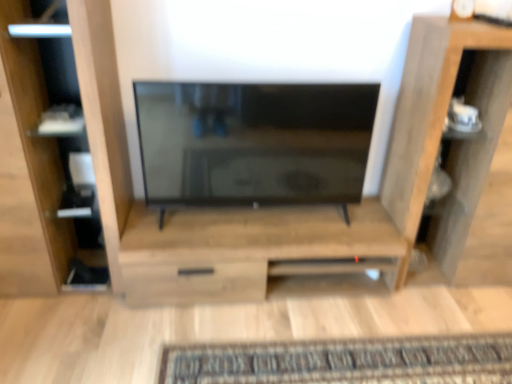
Question: From the image's perspective, is matte black tv at center located beneath wooden cabinet at center?

Choices:
 (A) no
 (B) yes

Answer: (A)

Question: Does matte black tv at center have a greater height compared to wooden cabinet at center?

Choices:
 (A) yes
 (B) no

Answer: (A)

Question: Is matte black tv at center shorter than wooden cabinet at center?

Choices:
 (A) no
 (B) yes

Answer: (A)

Question: Can you confirm if matte black tv at center is bigger than wooden cabinet at center?

Choices:
 (A) no
 (B) yes

Answer: (A)

Question: From a real-world perspective, is matte black tv at center on top of wooden cabinet at center?

Choices:
 (A) yes
 (B) no

Answer: (A)

Question: Considering the relative positions of matte black tv at center and wooden shelf at right in the image provided, is matte black tv at center to the left or to the right of wooden shelf at right?

Choices:
 (A) right
 (B) left

Answer: (B)

Question: Is matte black tv at center taller or shorter than wooden shelf at right?

Choices:
 (A) tall
 (B) short

Answer: (B)

Question: Does point (254, 165) appear closer or farther from the camera than point (406, 175)?

Choices:
 (A) farther
 (B) closer

Answer: (B)

Question: From a real-world perspective, is matte black tv at center physically located above or below wooden shelf at right?

Choices:
 (A) above
 (B) below

Answer: (A)

Question: Is point (20, 64) positioned closer to the camera than point (266, 196)?

Choices:
 (A) closer
 (B) farther

Answer: (A)

Question: Based on their positions, is matte wood shelf at left located to the left or right of matte black tv at center?

Choices:
 (A) right
 (B) left

Answer: (B)

Question: Is matte wood shelf at left inside or outside of matte black tv at center?

Choices:
 (A) outside
 (B) inside

Answer: (A)

Question: In terms of size, does matte wood shelf at left appear bigger or smaller than matte black tv at center?

Choices:
 (A) small
 (B) big

Answer: (B)

Question: Is wooden cabinet at center wider or thinner than wooden shelf at right?

Choices:
 (A) wide
 (B) thin

Answer: (A)

Question: Is point (250, 281) positioned closer to the camera than point (400, 94)?

Choices:
 (A) closer
 (B) farther

Answer: (A)